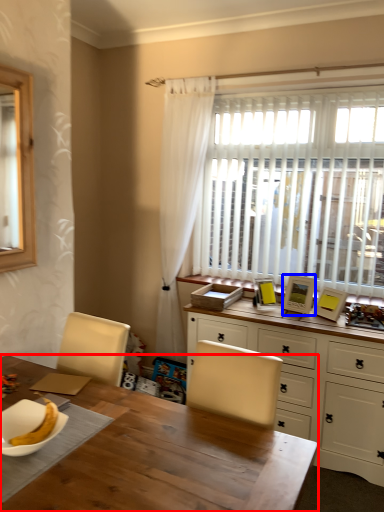
Question: Which point is further to the camera, desk (highlighted by a red box) or picture frame (highlighted by a blue box)?

Choices:
 (A) desk
 (B) picture frame

Answer: (B)